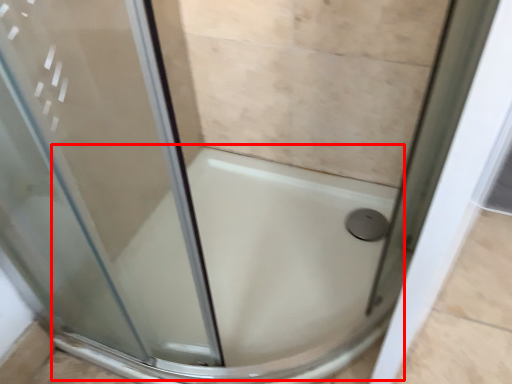
Question: From the image's perspective, where is bath (annotated by the red box) located in relation to shower in the image?

Choices:
 (A) above
 (B) below

Answer: (B)